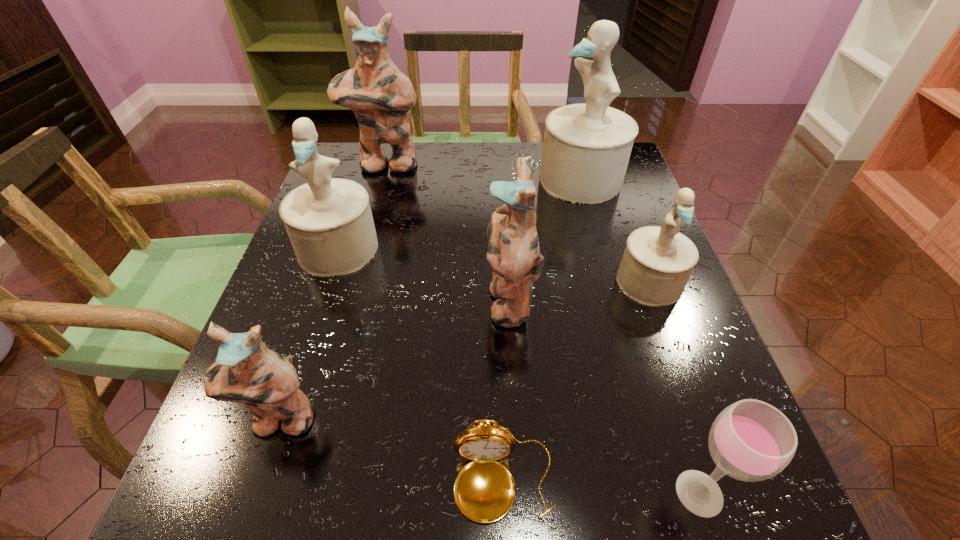
Find the location of a particular element. This screenshot has height=540, width=960. the farthest white figurine is located at coordinates (586, 149).

Locate an element on the screen. This screenshot has height=540, width=960. the farthest pink figurine is located at coordinates (380, 95).

This screenshot has width=960, height=540. Find the location of `the leftmost white figurine`. the leftmost white figurine is located at coordinates (329, 222).

Locate an element on the screen. The height and width of the screenshot is (540, 960). the fourth figurine from left to right is located at coordinates pyautogui.click(x=512, y=251).

The image size is (960, 540). I want to click on the rightmost pink figurine, so click(x=512, y=251).

Image resolution: width=960 pixels, height=540 pixels. I want to click on the smallest white figurine, so click(657, 263).

Image resolution: width=960 pixels, height=540 pixels. What are the coordinates of `the nearest pink figurine` in the screenshot? It's located at (246, 371).

Where is `the sixth farthest object`? This screenshot has width=960, height=540. the sixth farthest object is located at coordinates coord(246,371).

I want to click on wineglass, so click(x=750, y=440).

Identify the location of the shortest object. This screenshot has width=960, height=540. [x=484, y=490].